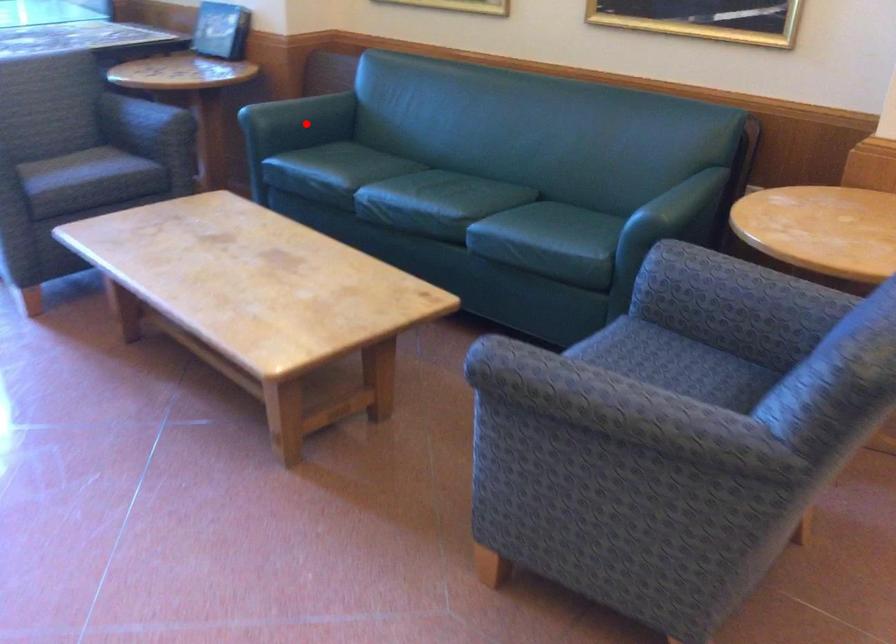
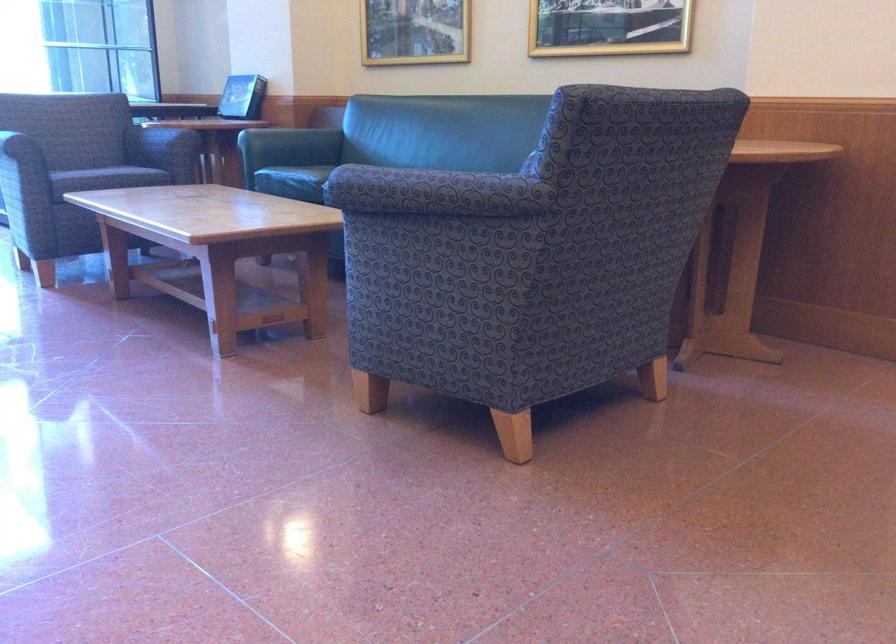
Find the pixel in the second image that matches the highlighted location in the first image.

(290, 145)